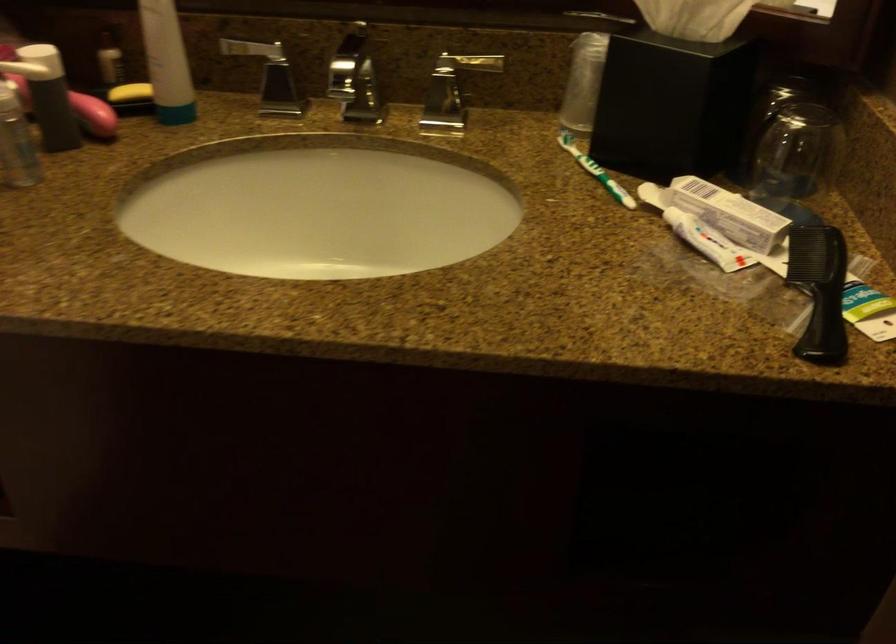
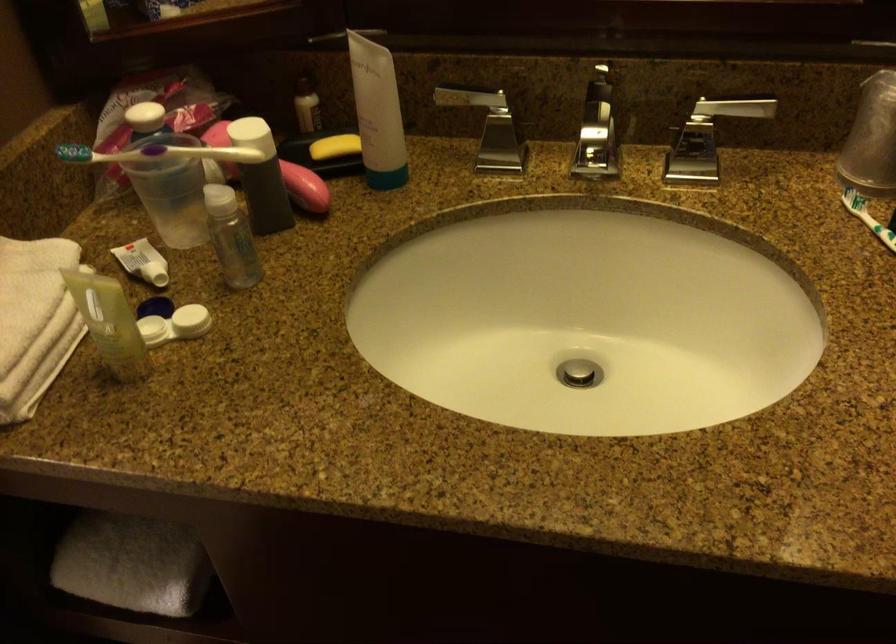
Question: The camera is either moving clockwise (left) or counter-clockwise (right) around the object. The first image is from the beginning of the video and the second image is from the end. Is the camera moving left or right when shooting the video?

Choices:
 (A) Left
 (B) Right

Answer: (B)